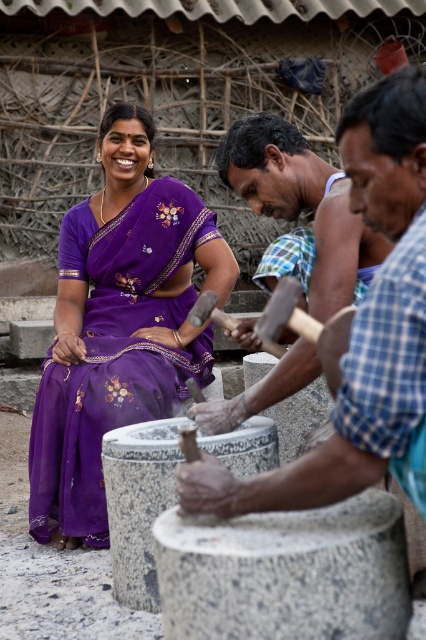
Question: Which point is closer to the camera?

Choices:
 (A) (57, 436)
 (B) (367, 284)

Answer: (B)

Question: Is purple silk saree at center further to camera compared to smooth wooden hammer at center?

Choices:
 (A) no
 (B) yes

Answer: (B)

Question: Can you confirm if purple silk saree at center is bigger than smooth wooden hammer at center?

Choices:
 (A) yes
 (B) no

Answer: (A)

Question: Which point is closer to the camera taking this photo?

Choices:
 (A) (287, 161)
 (B) (69, 528)

Answer: (A)

Question: Considering the relative positions of purple silk saree at center and smooth wooden hammer at center in the image provided, where is purple silk saree at center located with respect to smooth wooden hammer at center?

Choices:
 (A) right
 (B) left

Answer: (B)